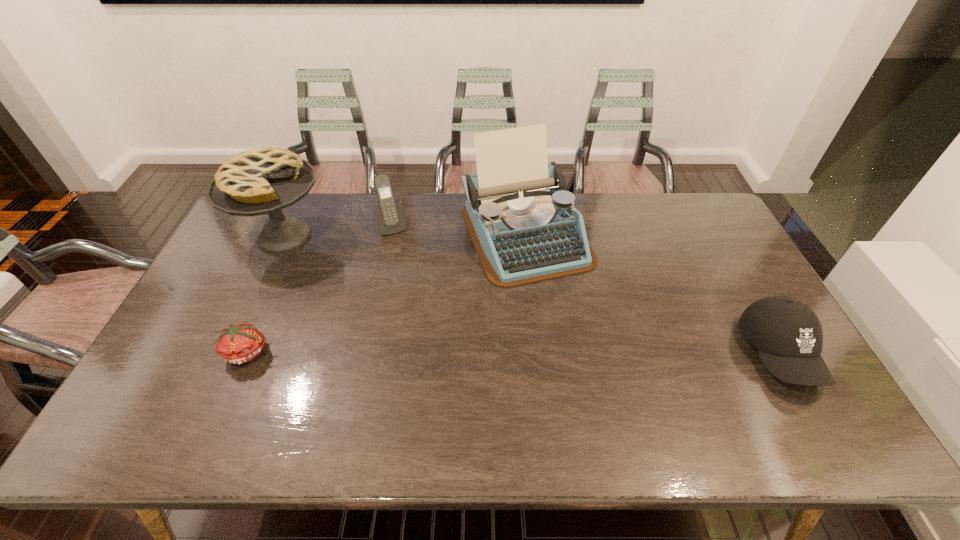
The image size is (960, 540). I want to click on tomato, so click(238, 343).

You are a GUI agent. You are given a task and a screenshot of the screen. Output one action in this format:
    pyautogui.click(x=<x>, y=<y>)
    Task: Click on the rightmost object
    
    Given the screenshot: What is the action you would take?
    pyautogui.click(x=788, y=335)

In order to click on baseball cap in this screenshot , I will do `click(788, 335)`.

The width and height of the screenshot is (960, 540). Identify the location of cellular telephone. (390, 215).

Image resolution: width=960 pixels, height=540 pixels. Identify the location of the third tallest object. (390, 215).

Where is `typewriter`? typewriter is located at coordinates (524, 226).

Find the location of `pie`. pie is located at coordinates (258, 181).

Image resolution: width=960 pixels, height=540 pixels. Identify the location of vacant area situated on the back of the tomato. (281, 273).

Find the location of a particular element. vacant region located on the front-facing side of the third object from left to right is located at coordinates (434, 322).

The image size is (960, 540). In order to click on blank space located 0.070m on the front-facing side of the third object from left to right in this screenshot , I will do `click(403, 249)`.